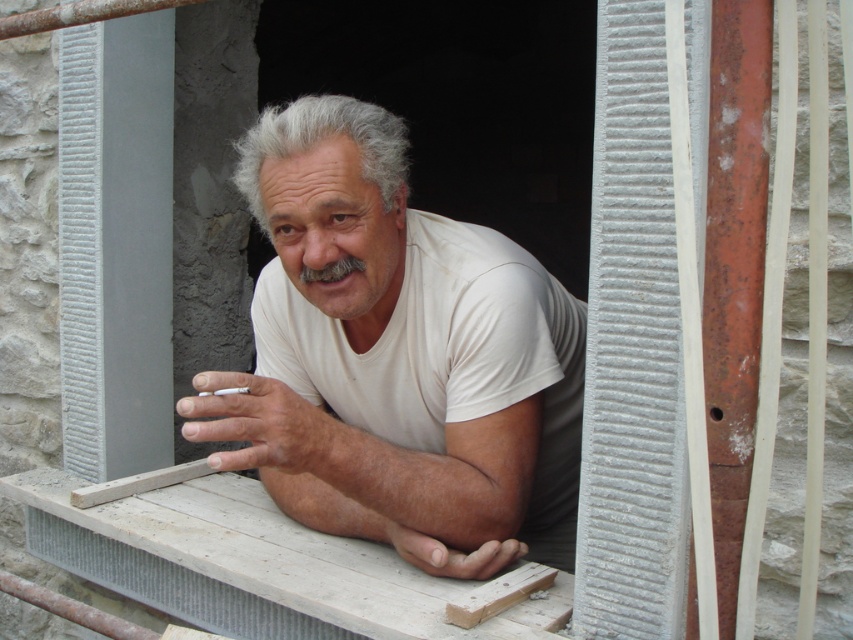
You are standing at the point with coordinates point (260, 280) and want to move to the point with coordinates point (437, 412). Given the scene described, can you reach the destination without passing through the unfinished window frame?

Point (437, 412) is in front of point (260, 280). Since the unfinished window frame is part of the structure, you can reach the destination by moving forward as the destination point is closer to the viewer than the starting point.